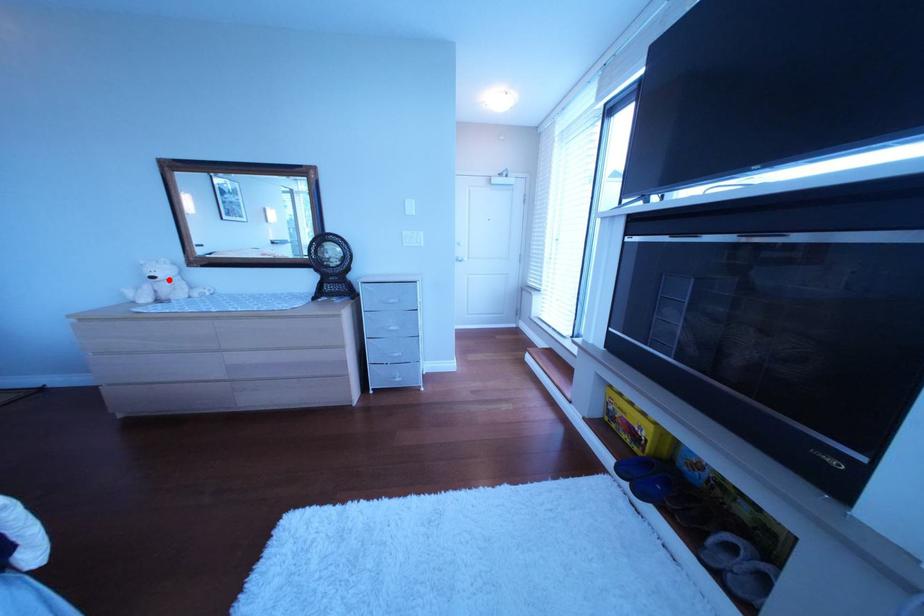
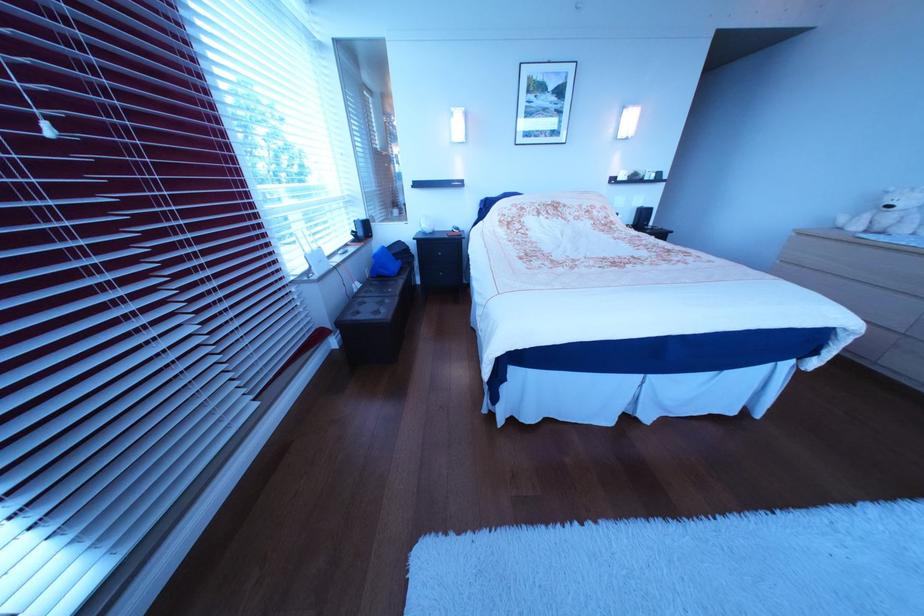
Question: I am providing you with two images of the same scene from different viewpoints. Given a red point in image1, look at the same physical point in image2. Is it:

Choices:
 (A) Closer to the viewpoint
 (B) Farther from the viewpoint

Answer: (B)